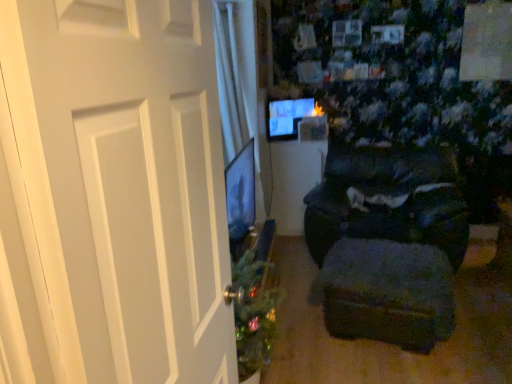
Question: Is matte black table at center outside of white matte door at left?

Choices:
 (A) yes
 (B) no

Answer: (A)

Question: Does matte black table at center have a greater width compared to white matte door at left?

Choices:
 (A) yes
 (B) no

Answer: (A)

Question: Are matte black table at center and white matte door at left beside each other?

Choices:
 (A) yes
 (B) no

Answer: (B)

Question: Does matte black table at center have a greater height compared to white matte door at left?

Choices:
 (A) no
 (B) yes

Answer: (A)

Question: Is matte black table at center oriented towards white matte door at left?

Choices:
 (A) yes
 (B) no

Answer: (A)

Question: Is matte black table at center thinner than white matte door at left?

Choices:
 (A) no
 (B) yes

Answer: (A)

Question: Is dark fabric ottoman at lower right at the right side of matte black monitor at upper center?

Choices:
 (A) no
 (B) yes

Answer: (B)

Question: From a real-world perspective, does dark fabric ottoman at lower right stand above matte black monitor at upper center?

Choices:
 (A) no
 (B) yes

Answer: (A)

Question: Is dark fabric ottoman at lower right directly adjacent to matte black monitor at upper center?

Choices:
 (A) no
 (B) yes

Answer: (A)

Question: From the image's perspective, is dark fabric ottoman at lower right located beneath matte black monitor at upper center?

Choices:
 (A) no
 (B) yes

Answer: (B)

Question: From the image's perspective, does dark fabric ottoman at lower right appear higher than matte black monitor at upper center?

Choices:
 (A) yes
 (B) no

Answer: (B)

Question: Considering the relative positions of dark fabric ottoman at lower right and matte black monitor at upper center in the image provided, is dark fabric ottoman at lower right in front of matte black monitor at upper center?

Choices:
 (A) yes
 (B) no

Answer: (A)

Question: From the image's perspective, is dark fabric ottoman at lower right on top of matte black table at center?

Choices:
 (A) no
 (B) yes

Answer: (A)